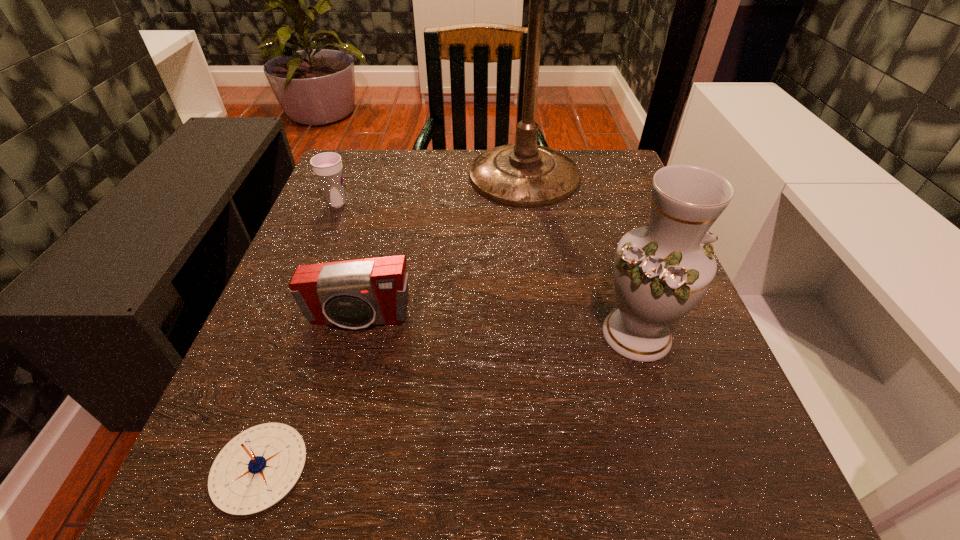
Find the location of a particular element. the tallest object is located at coordinates (524, 175).

Where is `the second tallest object`? the second tallest object is located at coordinates (661, 271).

Identify the location of camera. (354, 294).

Image resolution: width=960 pixels, height=540 pixels. Find the location of `cup`. cup is located at coordinates (327, 166).

The width and height of the screenshot is (960, 540). I want to click on the nearest object, so click(x=256, y=469).

Image resolution: width=960 pixels, height=540 pixels. Identify the location of compass. (256, 469).

I want to click on blank space located above the green lampshade of the tallest object, so click(535, 252).

Locate an element on the screen. This screenshot has height=540, width=960. vacant area situated 0.280m on the back of the second tallest object is located at coordinates (595, 206).

Find the location of a particular element. free point located 0.070m on the front-facing side of the camera is located at coordinates (345, 373).

Locate an element on the screen. vacant space located on the right of the cup is located at coordinates (470, 204).